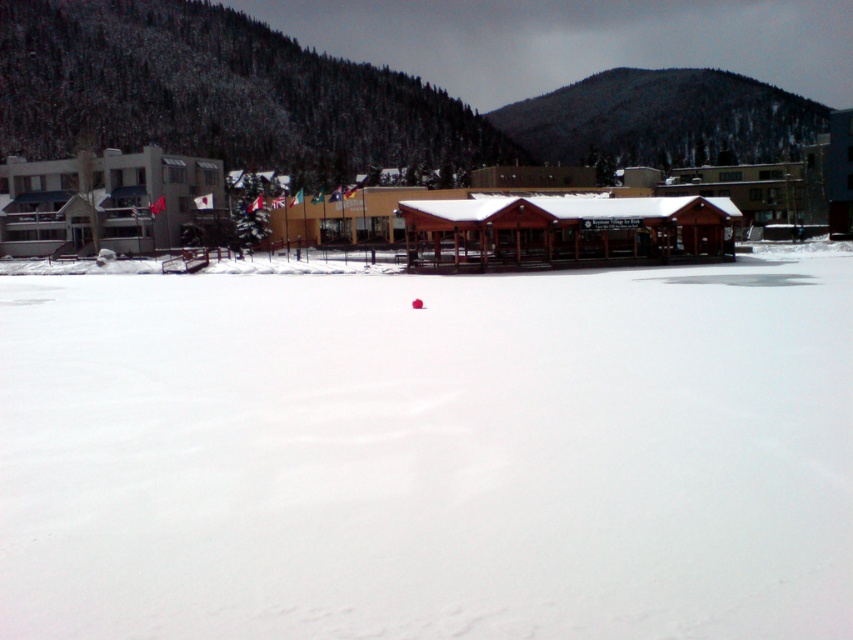
Question: Which object is farther from the camera taking this photo?

Choices:
 (A) matte gray building at left
 (B) wooden hut at center
 (C) brown wooden ski resort at center

Answer: (A)

Question: Which is nearer to the white snow at center?

Choices:
 (A) brown wooden hut at center
 (B) matte gray building at left
 (C) wooden hut at center
 (D) brown wooden ski resort at center

Answer: (C)

Question: Does white snow at center have a smaller size compared to matte gray building at left?

Choices:
 (A) no
 (B) yes

Answer: (B)

Question: Which is nearer to the wooden hut at center?

Choices:
 (A) white snow at center
 (B) brown wooden hut at center
 (C) matte gray building at left
 (D) brown wooden ski resort at center

Answer: (D)

Question: Observing the image, what is the correct spatial positioning of white snow at center in reference to brown wooden ski resort at center?

Choices:
 (A) above
 (B) below

Answer: (B)

Question: Considering the relative positions of brown wooden ski resort at center and brown wooden hut at center in the image provided, where is brown wooden ski resort at center located with respect to brown wooden hut at center?

Choices:
 (A) left
 (B) right

Answer: (A)